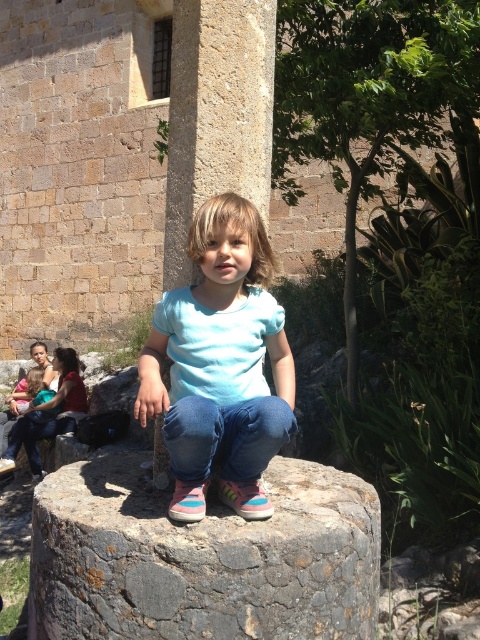
Can you confirm if denim at center is smaller than light blue t-shirt at center?

Yes.

Which is more to the right, denim at center or light blue t-shirt at center?

denim at center is more to the right.

Is point (197, 465) positioned behind point (75, 388)?

No.

Locate an element on the screen. Image resolution: width=480 pixels, height=640 pixels. denim at center is located at coordinates (225, 436).

Does light blue cotton shirt at center have a lesser height compared to light blue t-shirt at center?

Yes, light blue cotton shirt at center is shorter than light blue t-shirt at center.

Does light blue cotton shirt at center appear over light blue t-shirt at center?

Correct, light blue cotton shirt at center is located above light blue t-shirt at center.

What are the coordinates of `light blue cotton shirt at center` in the screenshot? It's located at (220, 364).

This screenshot has width=480, height=640. What are the coordinates of `light blue cotton shirt at center` in the screenshot? It's located at (220, 364).

Who is more distant from viewer, (365, 490) or (247, 480)?

Point (365, 490)

In the scene shown: Does rusty stone boulder at center have a smaller size compared to denim at center?

Actually, rusty stone boulder at center might be larger than denim at center.

Where is `rusty stone boulder at center`? The width and height of the screenshot is (480, 640). rusty stone boulder at center is located at coordinates (202, 557).